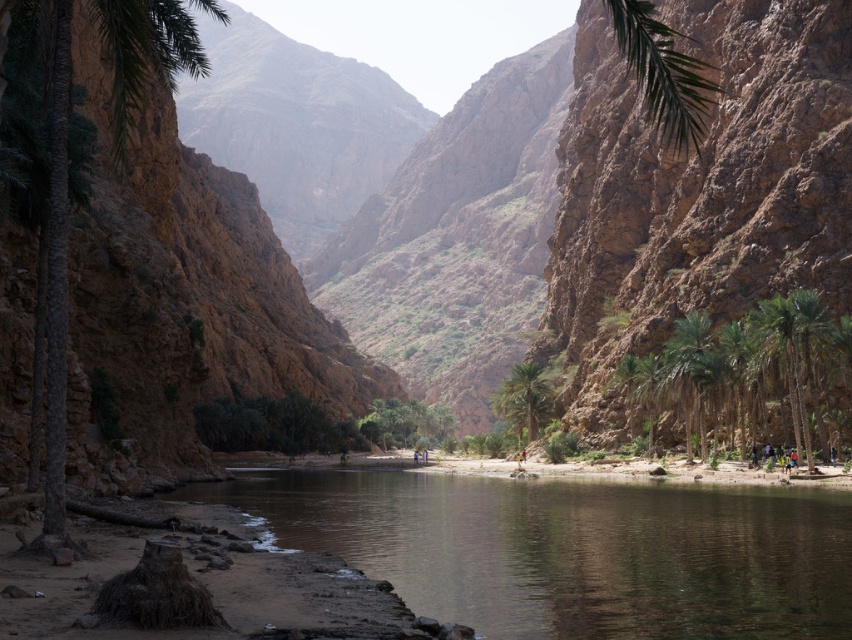
Question: Which point is closer to the camera?

Choices:
 (A) (530, 364)
 (B) (812, 636)
 (C) (568, 339)

Answer: (B)

Question: Can you confirm if green leafy palm tree at center-right is smaller than green leafy palm tree at center?

Choices:
 (A) no
 (B) yes

Answer: (B)

Question: Which object is the farthest from the green leafy palm tree at center?

Choices:
 (A) brown smooth river at center
 (B) green leafy palm tree at center-right
 (C) brown rough rock at upper right

Answer: (A)

Question: Among these objects, which one is farthest from the camera?

Choices:
 (A) green leafy palm tree at center-right
 (B) brown smooth river at center

Answer: (A)

Question: Does green leafy palm tree at center-right have a smaller size compared to green leafy palm tree at center?

Choices:
 (A) no
 (B) yes

Answer: (B)

Question: Can you confirm if brown rough rock at upper right is positioned to the right of green leafy palm tree at center-right?

Choices:
 (A) yes
 (B) no

Answer: (A)